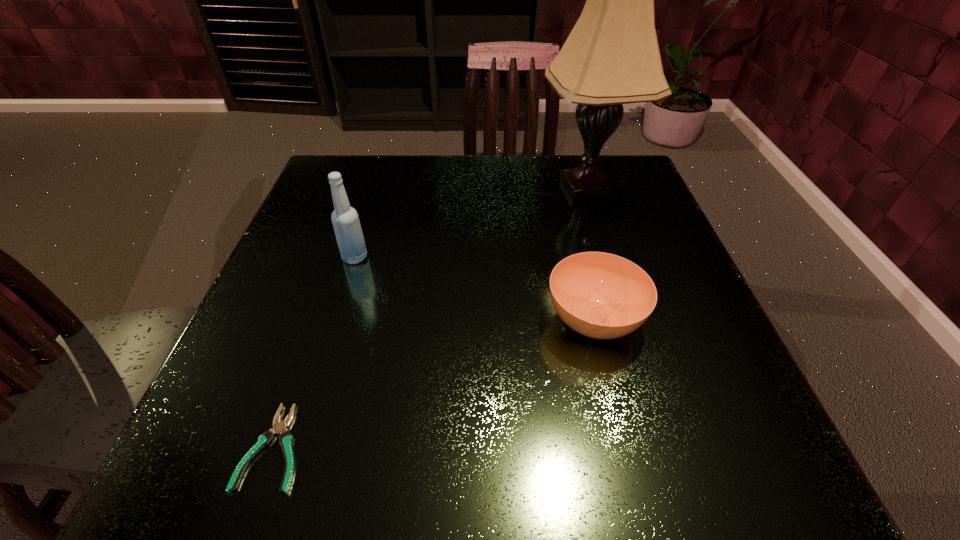
Locate an element on the screen. The height and width of the screenshot is (540, 960). free point between the shortest object and the third nearest object is located at coordinates (315, 352).

This screenshot has height=540, width=960. I want to click on free area in between the shortest object and the third nearest object, so click(x=315, y=352).

Locate an element on the screen. Image resolution: width=960 pixels, height=540 pixels. free space between the second nearest object and the nearest object is located at coordinates (434, 383).

Identify the location of empty space that is in between the pliers and the second shortest object. The width and height of the screenshot is (960, 540). (434, 383).

Identify the location of object that is the closest one to the lamp. (604, 296).

This screenshot has width=960, height=540. Identify the location of object that is the nearest to the bottle. (279, 427).

Locate an element on the screen. This screenshot has width=960, height=540. vacant space that satisfies the following two spatial constraints: 1. on the back side of the second nearest object; 2. on the right side of the lamp is located at coordinates (562, 187).

Where is `free space that satisfies the following two spatial constraints: 1. on the back side of the soup bowl; 2. on the right side of the nearest object`? The image size is (960, 540). free space that satisfies the following two spatial constraints: 1. on the back side of the soup bowl; 2. on the right side of the nearest object is located at coordinates (318, 320).

Find the location of a particular element. Image resolution: width=960 pixels, height=540 pixels. free location that satisfies the following two spatial constraints: 1. on the back side of the tallest object; 2. on the left side of the shortest object is located at coordinates (364, 187).